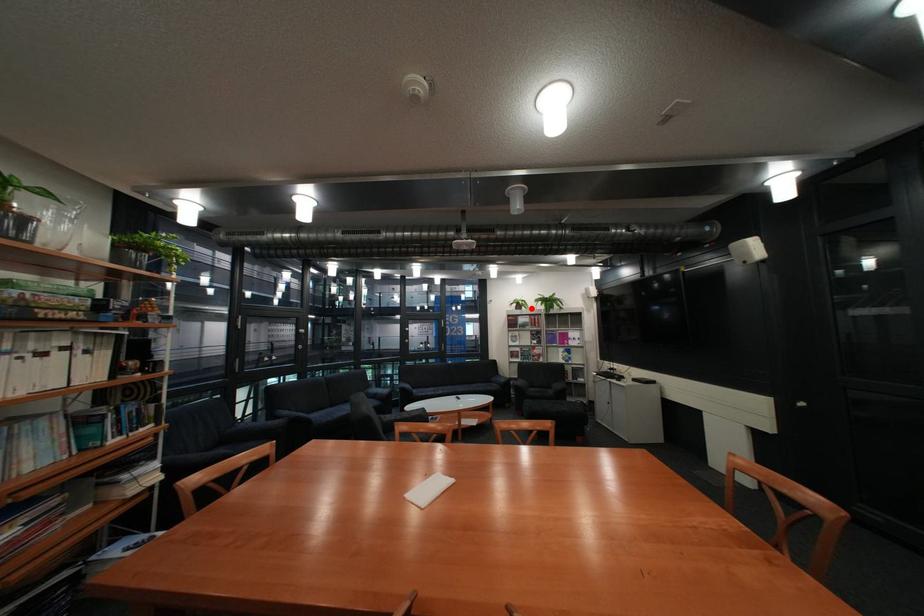
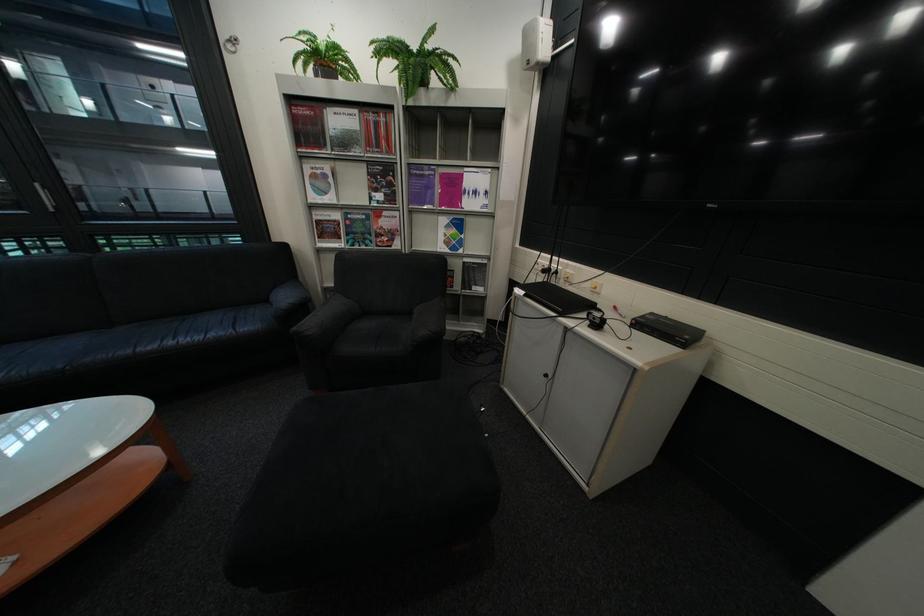
In the second image, find the point that corresponds to the highlighted location in the first image.

(333, 78)